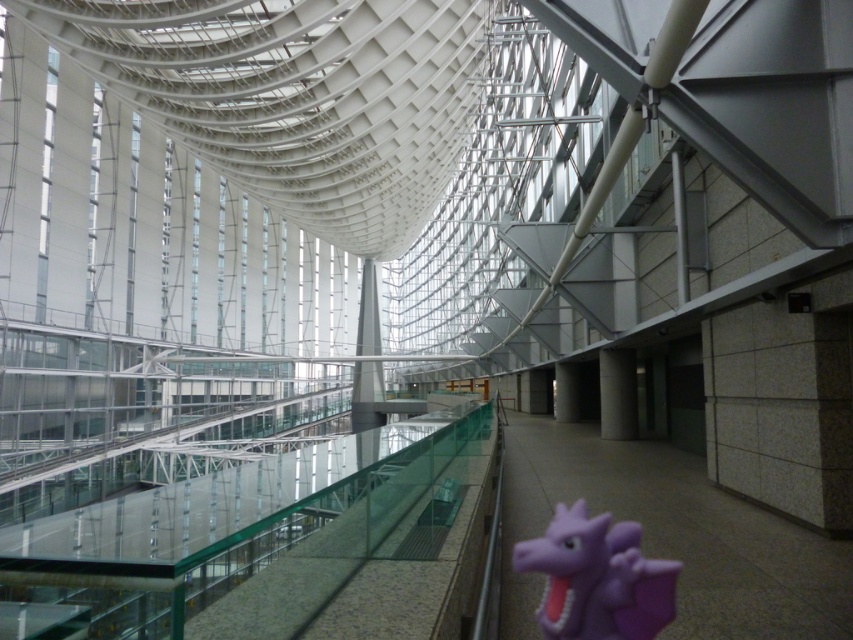
You are an interior designer planning to place a new sculpture in the space. The sculpture requires a base that must be wider than the purple rubber dragon at lower right but narrower than the white glossy pillar at center. Is there a suitable location between these two objects where this requirement can be met?

Yes, since the purple rubber dragon at lower right is thinner than the white glossy pillar at center, there is a range of widths available between their dimensions to accommodate the sculpture base.

You are standing in the modern interior space described. You notice two points marked in the scene. Which point is nearer to you, point (627, 573) or point (636, 429)?

Point (627, 573) is closer to the viewer than point (636, 429).